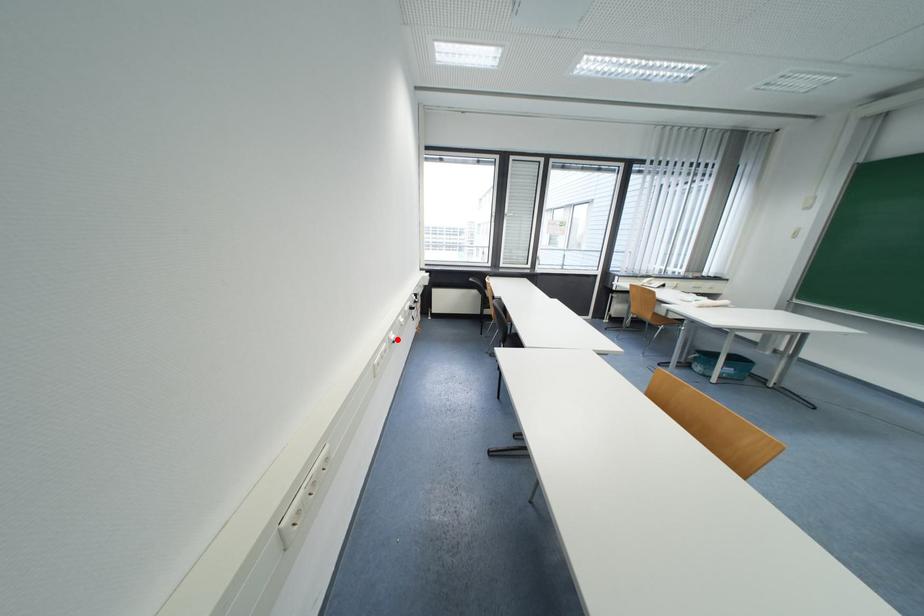
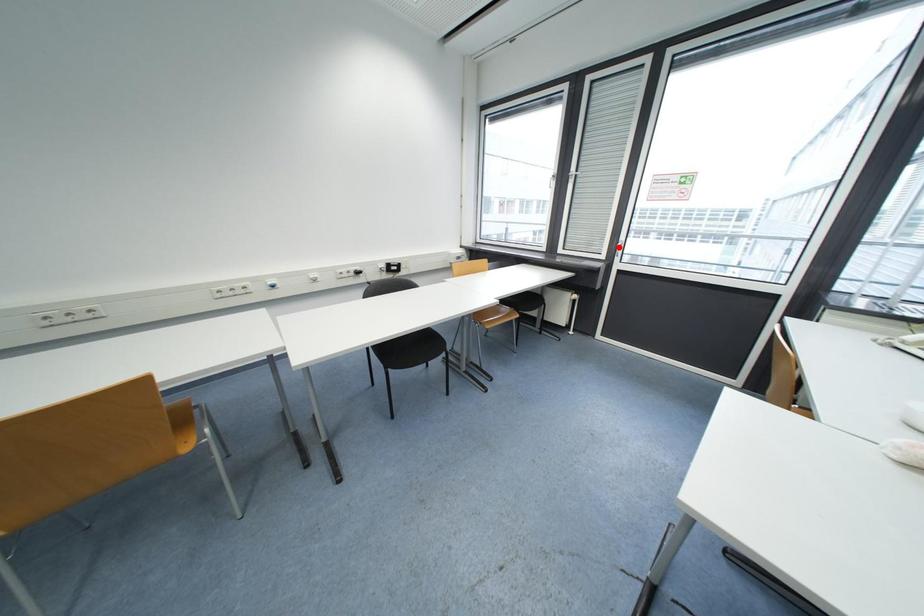
I am providing you with two images of the same scene from different viewpoints. A red point is marked on the first image and another point is marked on the second image. Are the points marked in image1 and image2 representing the same 3D position?

No